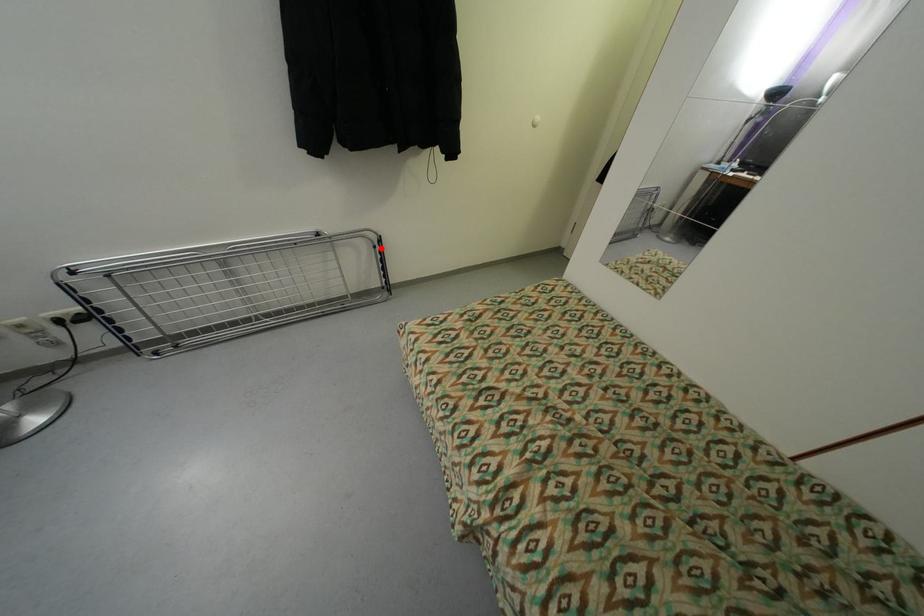
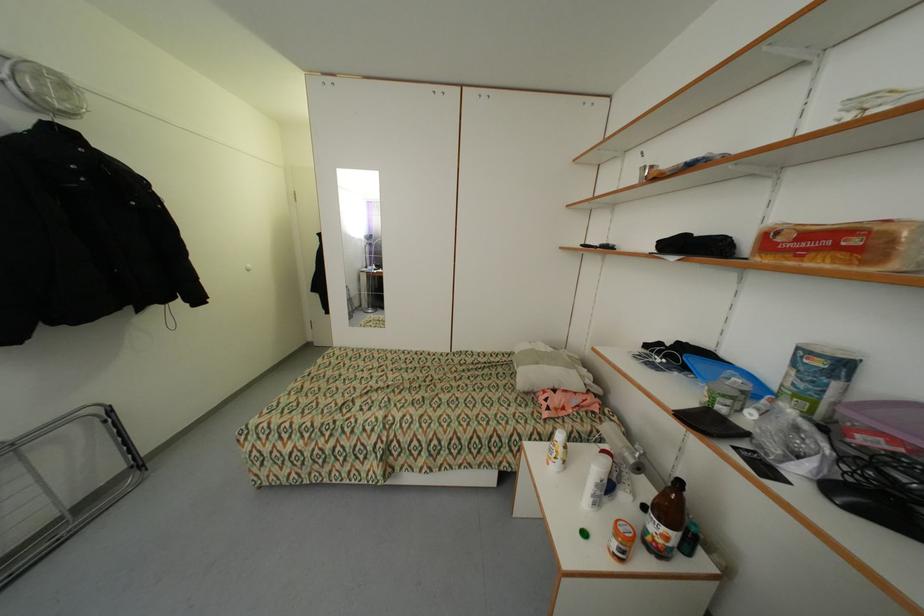
In the second image, find the point that corresponds to the highlighted location in the first image.

(112, 422)